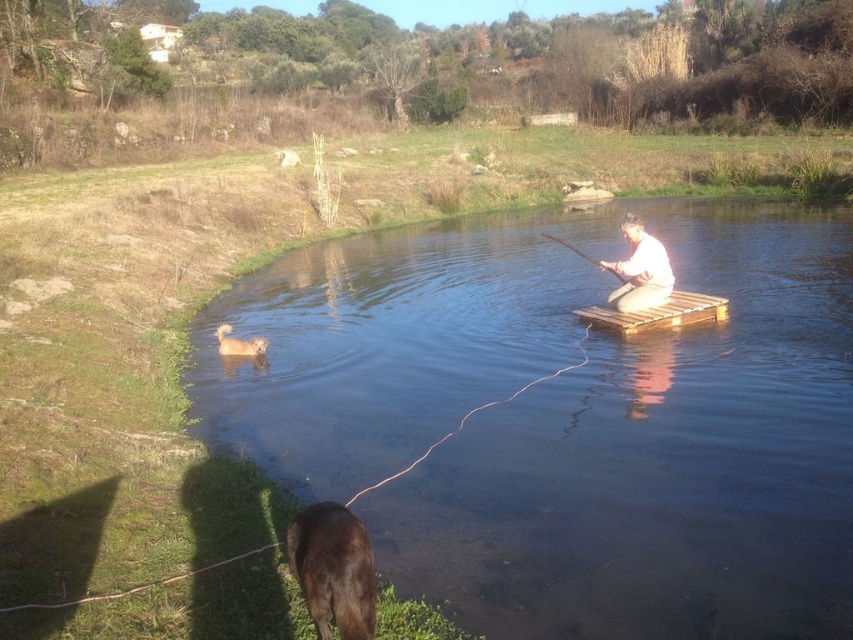
You are planning to take a small boat ride on the river shown in the image. You notice the clear water at center and the fuzzy beige dog at lower left. Which object would you need to avoid getting too close to if you want to stay in deeper water?

The clear water at center is larger in size than the fuzzy beige dog at lower left, so the deeper water is likely at the clear water at center. Therefore, you should avoid getting too close to the fuzzy beige dog at lower left to stay in deeper water.

You are standing on the grassy bank where the dark dog is located. You want to reach the person on the floating wooden platform. Which point, point [456,253] or point [253,342], is closer to you?

Point [456,253] is closer to you because it is further to the camera than point [253,342], meaning it is physically nearer in the scene.

You are standing on the grassy bank where the dark dog is located. You see the white cotton shirt at center and the wooden stick at center in the middle ground. Which object is taller?

The wooden stick at center is taller than the white cotton shirt at center.